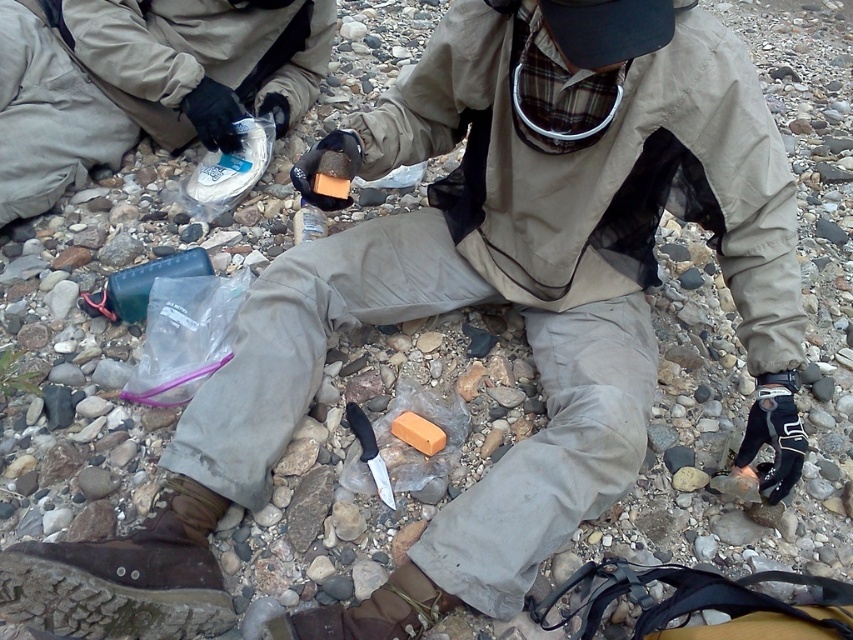
Which is below, matte khaki pants at center or brown leather shoe at lower left?

brown leather shoe at lower left is below.

Can you confirm if matte khaki pants at center is taller than brown leather shoe at lower left?

Correct, matte khaki pants at center is much taller as brown leather shoe at lower left.

Who is more distant from viewer, (27,138) or (167,524)?

Positioned behind is point (27,138).

Find the location of `matte khaki pants at center`. matte khaki pants at center is located at coordinates (143, 81).

Can you confirm if brown suede shoe at lower center is thinner than black plastic knife at center?

In fact, brown suede shoe at lower center might be wider than black plastic knife at center.

Is the position of brown suede shoe at lower center more distant than that of black plastic knife at center?

No.

What do you see at coordinates (372, 611) in the screenshot? I see `brown suede shoe at lower center` at bounding box center [372, 611].

Find the location of a particular element. brown suede shoe at lower center is located at coordinates (372, 611).

How distant is brown leather shoe at lower left from green plastic bottle at center?

Result: The distance of brown leather shoe at lower left from green plastic bottle at center is 48.51 centimeters.

Who is positioned more to the left, brown leather shoe at lower left or green plastic bottle at center?

green plastic bottle at center

Which is in front, point (28, 592) or point (199, 262)?

Point (28, 592) is in front.

This screenshot has width=853, height=640. In order to click on brown leather shoe at lower left in this screenshot , I will do `click(126, 576)`.